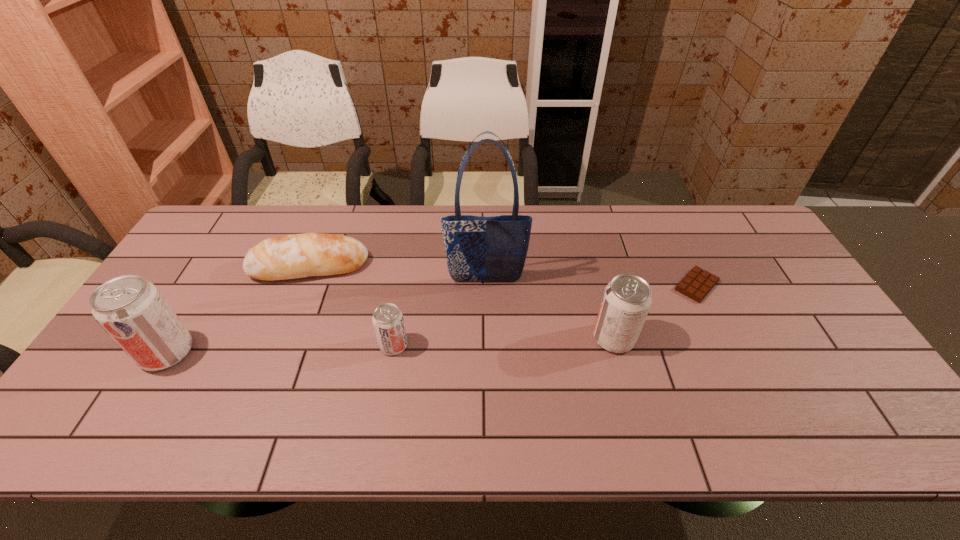
Locate an element on the screen. The height and width of the screenshot is (540, 960). empty space that is in between the shortest soda can and the second shortest object is located at coordinates (351, 306).

Where is `vacant space that's between the leftmost soda can and the second shortest object`? vacant space that's between the leftmost soda can and the second shortest object is located at coordinates (238, 309).

Find the location of `free space between the third object from right to left and the shortest object`. free space between the third object from right to left and the shortest object is located at coordinates 591,283.

This screenshot has width=960, height=540. What are the coordinates of `free space that is in between the third object from left to right and the bread` in the screenshot? It's located at (351, 306).

Where is `vacant space that is in between the rightmost soda can and the second soda can from right to left`? The width and height of the screenshot is (960, 540). vacant space that is in between the rightmost soda can and the second soda can from right to left is located at coordinates (504, 342).

The width and height of the screenshot is (960, 540). I want to click on free space between the tallest object and the second soda can from right to left, so (x=440, y=313).

You are a GUI agent. You are given a task and a screenshot of the screen. Output one action in this format:
    pyautogui.click(x=<x>, y=<y>)
    Task: Click on the free space between the fourth object from left to right and the leftmost object
    
    Given the screenshot: What is the action you would take?
    pyautogui.click(x=326, y=316)

You are a GUI agent. You are given a task and a screenshot of the screen. Output one action in this format:
    pyautogui.click(x=<x>, y=<y>)
    Task: Click on the object that is the third nearest to the fourth object from right to left
    
    Given the screenshot: What is the action you would take?
    pyautogui.click(x=135, y=314)

Identify the location of object that is the fifth closest to the second soda can from left to right. This screenshot has width=960, height=540. (696, 285).

I want to click on soda can that is the nearest to the third object from right to left, so click(388, 323).